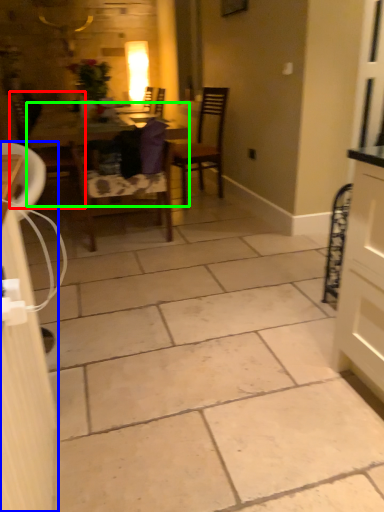
Question: Considering the real-world distances, which object is closest to chair (highlighted by a red box)? cabinetry (highlighted by a blue box) or table (highlighted by a green box).

Choices:
 (A) cabinetry
 (B) table

Answer: (B)